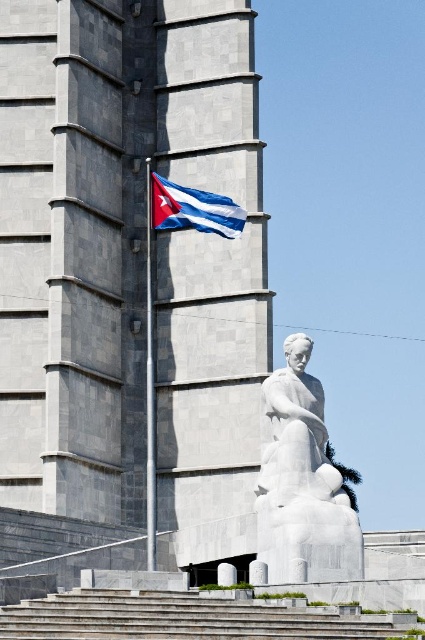
Question: Estimate the real-world distances between objects in this image. Which object is farther from the white marble statue at center?

Choices:
 (A) blue and white striped fabric at upper center
 (B) gray concrete stairs at lower center
 (C) smooth concrete tower at center

Answer: (C)

Question: Does smooth concrete tower at center appear under white marble statue at center?

Choices:
 (A) no
 (B) yes

Answer: (A)

Question: Among these points, which one is farthest from the camera?

Choices:
 (A) (212, 216)
 (B) (56, 17)

Answer: (B)

Question: Based on their relative distances, which object is nearer to the smooth concrete tower at center?

Choices:
 (A) gray concrete stairs at lower center
 (B) blue and white striped fabric at upper center

Answer: (B)

Question: Does white marble statue at center have a lesser width compared to blue and white striped fabric at upper center?

Choices:
 (A) yes
 (B) no

Answer: (B)

Question: Can you confirm if white marble statue at center is positioned below blue and white striped fabric at upper center?

Choices:
 (A) no
 (B) yes

Answer: (B)